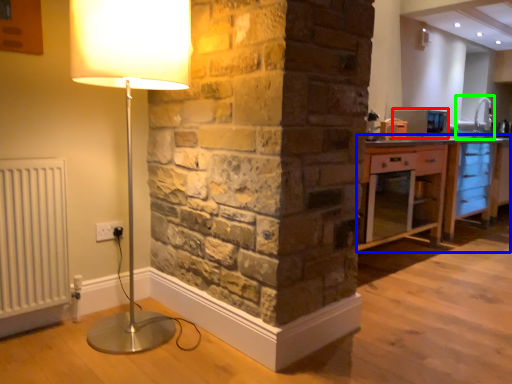
Question: Estimate the real-world distances between objects in this image. Which object is closer to appliance (highlighted by a red box), cabinetry (highlighted by a blue box) or sink (highlighted by a green box)?

Choices:
 (A) cabinetry
 (B) sink

Answer: (A)